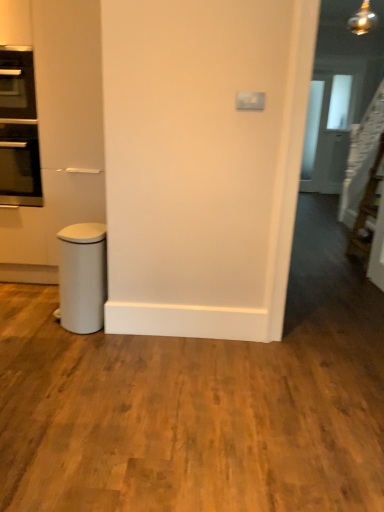
Question: Can white matte waste bin at lower left be found inside black glass oven at left?

Choices:
 (A) yes
 (B) no

Answer: (B)

Question: From the image's perspective, is black glass oven at left located beneath white matte waste bin at lower left?

Choices:
 (A) yes
 (B) no

Answer: (B)

Question: Does black glass oven at left appear on the right side of white matte waste bin at lower left?

Choices:
 (A) yes
 (B) no

Answer: (B)

Question: Considering the relative positions of black glass oven at left and white matte waste bin at lower left in the image provided, is black glass oven at left in front of white matte waste bin at lower left?

Choices:
 (A) no
 (B) yes

Answer: (A)

Question: Can you confirm if black glass oven at left is bigger than white matte waste bin at lower left?

Choices:
 (A) no
 (B) yes

Answer: (B)

Question: From the image's perspective, would you say black glass oven at left is positioned over white matte waste bin at lower left?

Choices:
 (A) no
 (B) yes

Answer: (B)

Question: From a real-world perspective, is black glass oven at left positioned under transparent glass door at upper right based on gravity?

Choices:
 (A) no
 (B) yes

Answer: (A)

Question: Does black glass oven at left have a greater width compared to transparent glass door at upper right?

Choices:
 (A) yes
 (B) no

Answer: (A)

Question: Is black glass oven at left aimed at transparent glass door at upper right?

Choices:
 (A) no
 (B) yes

Answer: (A)

Question: Can you confirm if black glass oven at left is bigger than transparent glass door at upper right?

Choices:
 (A) no
 (B) yes

Answer: (A)

Question: Can you confirm if black glass oven at left is smaller than transparent glass door at upper right?

Choices:
 (A) yes
 (B) no

Answer: (A)

Question: From a real-world perspective, is black glass oven at left on top of transparent glass door at upper right?

Choices:
 (A) yes
 (B) no

Answer: (A)

Question: From the image's perspective, is white matte waste bin at lower left located beneath transparent glass door at upper right?

Choices:
 (A) no
 (B) yes

Answer: (B)